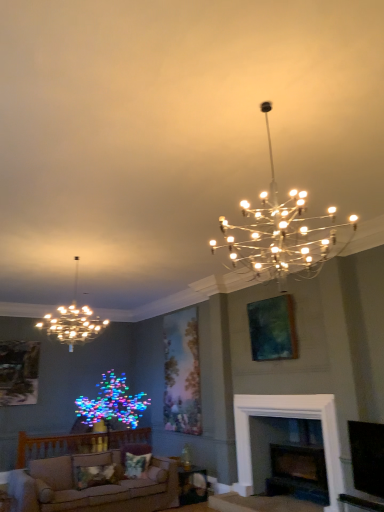
At what (x,y) coordinates should I click in order to perform the action: click on teal matte painting at upper right, marked as the 2th picture frame in a bottom-to-top arrangement. Please return your answer as a coordinate pair (x, y). This screenshot has width=384, height=512. Looking at the image, I should click on (x=273, y=329).

Describe the element at coordinates (273, 329) in the screenshot. I see `teal matte painting at upper right, marked as the 2th picture frame in a bottom-to-top arrangement` at that location.

This screenshot has width=384, height=512. What do you see at coordinates (289, 417) in the screenshot? I see `dark wood fireplace at lower center` at bounding box center [289, 417].

This screenshot has width=384, height=512. I want to click on metallic chandelier at upper center, the first lamp in the right-to-left sequence, so click(x=280, y=231).

Find the location of a particular element. teal matte painting at upper right, arranged as the first picture frame when viewed from the top is located at coordinates (273, 329).

Looking at this image, based on their positions, is teal matte painting at upper right, arranged as the first picture frame when viewed from the top, located to the left or right of beige fabric couch at lower left?

In the image, teal matte painting at upper right, arranged as the first picture frame when viewed from the top, appears on the right side of beige fabric couch at lower left.

In the scene shown: Does teal matte painting at upper right, positioned as the second picture frame in left-to-right order, contain beige fabric couch at lower left?

No, beige fabric couch at lower left is located outside of teal matte painting at upper right, positioned as the second picture frame in left-to-right order.

From a real-world perspective, which object stands above the other?

teal matte painting at upper right, placed as the 1th picture frame when sorted from front to back.

Is wooden textured picture frame at left, which is counted as the 1th picture frame, starting from the left, not near teal matte painting at upper right, marked as the 2th picture frame in a back-to-front arrangement?

Yes.

Can teal matte painting at upper right, positioned as the second picture frame in left-to-right order, be found inside wooden textured picture frame at left, the second picture frame positioned from the right?

That's incorrect, teal matte painting at upper right, positioned as the second picture frame in left-to-right order, is not inside wooden textured picture frame at left, the second picture frame positioned from the right.

Measure the distance between wooden textured picture frame at left, the 1th picture frame from the bottom, and teal matte painting at upper right, marked as the 2th picture frame in a back-to-front arrangement.

wooden textured picture frame at left, the 1th picture frame from the bottom, is 12.51 feet away from teal matte painting at upper right, marked as the 2th picture frame in a back-to-front arrangement.

Locate an element on the screen. This screenshot has width=384, height=512. picture frame above the wooden textured picture frame at left, the 1th picture frame viewed from the back (from a real-world perspective) is located at coordinates (273, 329).

This screenshot has width=384, height=512. What are the coordinates of `picture frame that is the 2nd object located behind the matte gold chandelier at upper left, the 2th lamp in the right-to-left sequence` in the screenshot? It's located at (18, 372).

Relative to wooden textured picture frame at left, the second picture frame positioned from the right, is matte gold chandelier at upper left, the 2th lamp in the front-to-back sequence, in front or behind?

Visually, matte gold chandelier at upper left, the 2th lamp in the front-to-back sequence, is located in front of wooden textured picture frame at left, the second picture frame positioned from the right.

Considering the sizes of objects matte gold chandelier at upper left, the 2th lamp in the right-to-left sequence, and wooden textured picture frame at left, which is counted as the 1th picture frame, starting from the left, in the image provided, who is bigger, matte gold chandelier at upper left, the 2th lamp in the right-to-left sequence, or wooden textured picture frame at left, which is counted as the 1th picture frame, starting from the left,?

With larger size is matte gold chandelier at upper left, the 2th lamp in the right-to-left sequence.

In the scene shown: From a real-world perspective, which is physically above, matte gold chandelier at upper left, the first lamp viewed from the left, or wooden textured picture frame at left, the 2th picture frame from the top?

matte gold chandelier at upper left, the first lamp viewed from the left.

Is dark wood fireplace at lower center positioned with its back to fluffy fabric pillow at lower center?

No, dark wood fireplace at lower center is not facing the opposite direction of fluffy fabric pillow at lower center.

From the image's perspective, is dark wood fireplace at lower center positioned above or below fluffy fabric pillow at lower center?

Based on their image positions, dark wood fireplace at lower center is located above fluffy fabric pillow at lower center.

Can you confirm if dark wood fireplace at lower center is shorter than fluffy fabric pillow at lower center?

No.

From a real-world perspective, is beige fabric couch at lower left positioned under dark wood fireplace at lower center based on gravity?

Yes, from a real-world perspective, beige fabric couch at lower left is beneath dark wood fireplace at lower center.

How many degrees apart are the facing directions of beige fabric couch at lower left and dark wood fireplace at lower center?

The facing directions of beige fabric couch at lower left and dark wood fireplace at lower center are 88.3 degrees apart.

From the image's perspective, which one is positioned higher, beige fabric couch at lower left or dark wood fireplace at lower center?

From the image's view, dark wood fireplace at lower center is above.

Consider the image. Considering the relative sizes of beige fabric couch at lower left and dark wood fireplace at lower center in the image provided, is beige fabric couch at lower left thinner than dark wood fireplace at lower center?

No, beige fabric couch at lower left is not thinner than dark wood fireplace at lower center.

From a real-world perspective, is beige fabric couch at lower left positioned above or below fluffy fabric pillow at lower center?

Clearly, from a real-world perspective, beige fabric couch at lower left is below fluffy fabric pillow at lower center.

Visually, is beige fabric couch at lower left positioned to the left or to the right of fluffy fabric pillow at lower center?

beige fabric couch at lower left is positioned on fluffy fabric pillow at lower center's left side.

Is beige fabric couch at lower left shorter than fluffy fabric pillow at lower center?

No.

Between beige fabric couch at lower left and fluffy fabric pillow at lower center, which one is positioned behind?

Positioned behind is fluffy fabric pillow at lower center.

Considering the sizes of objects wooden textured picture frame at left, which is counted as the 1th picture frame, starting from the left, and metallic chandelier at upper center, marked as the second lamp in a left-to-right arrangement, in the image provided, who is bigger, wooden textured picture frame at left, which is counted as the 1th picture frame, starting from the left, or metallic chandelier at upper center, marked as the second lamp in a left-to-right arrangement,?

metallic chandelier at upper center, marked as the second lamp in a left-to-right arrangement, is bigger.

Is wooden textured picture frame at left, the 1th picture frame from the bottom, located outside metallic chandelier at upper center, marked as the second lamp in a left-to-right arrangement?

Yes.

Is wooden textured picture frame at left, which is counted as the 1th picture frame, starting from the left, taller than metallic chandelier at upper center, marked as the second lamp in a left-to-right arrangement?

Indeed, wooden textured picture frame at left, which is counted as the 1th picture frame, starting from the left, has a greater height compared to metallic chandelier at upper center, marked as the second lamp in a left-to-right arrangement.

Are wooden textured picture frame at left, the second picture frame positioned from the right, and metallic chandelier at upper center, marked as the second lamp in a left-to-right arrangement, far apart?

Yes, wooden textured picture frame at left, the second picture frame positioned from the right, and metallic chandelier at upper center, marked as the second lamp in a left-to-right arrangement, are located far from each other.

The image size is (384, 512). Find the location of `studio couch below the teal matte painting at upper right, acting as the 1th picture frame starting from the right (from the image's perspective)`. studio couch below the teal matte painting at upper right, acting as the 1th picture frame starting from the right (from the image's perspective) is located at coordinates (92, 487).

Where is `picture frame located underneath the teal matte painting at upper right, placed as the 1th picture frame when sorted from front to back (from a real-world perspective)`? This screenshot has width=384, height=512. picture frame located underneath the teal matte painting at upper right, placed as the 1th picture frame when sorted from front to back (from a real-world perspective) is located at coordinates (18, 372).

Considering their positions, is metallic chandelier at upper center, the first lamp in the right-to-left sequence, positioned further to wooden textured picture frame at left, the 1th picture frame viewed from the back, than teal matte painting at upper right, positioned as the second picture frame in left-to-right order?

metallic chandelier at upper center, the first lamp in the right-to-left sequence, is further to wooden textured picture frame at left, the 1th picture frame viewed from the back.

Looking at the image, which one is located further to beige fabric couch at lower left, wooden textured picture frame at left, the 1th picture frame viewed from the back, or metallic chandelier at upper center, which is counted as the 2th lamp, starting from the back?

Among the two, metallic chandelier at upper center, which is counted as the 2th lamp, starting from the back, is located further to beige fabric couch at lower left.

Looking at the image, which one is located further to matte gold chandelier at upper left, the 2th lamp in the right-to-left sequence, metallic chandelier at upper center, which is counted as the 2th lamp, starting from the back, or dark wood fireplace at lower center?

The object further to matte gold chandelier at upper left, the 2th lamp in the right-to-left sequence, is dark wood fireplace at lower center.

When comparing their distances from wooden textured picture frame at left, the 1th picture frame viewed from the back, does matte gold chandelier at upper left, the 2th lamp in the right-to-left sequence, or teal matte painting at upper right, placed as the 1th picture frame when sorted from front to back, seem closer?

The object closer to wooden textured picture frame at left, the 1th picture frame viewed from the back, is matte gold chandelier at upper left, the 2th lamp in the right-to-left sequence.

In the scene shown: Which object lies nearer to the anchor point fluffy fabric pillow at lower center, wooden textured picture frame at left, which is counted as the 1th picture frame, starting from the left, or matte gold chandelier at upper left, the first lamp viewed from the left?

wooden textured picture frame at left, which is counted as the 1th picture frame, starting from the left, lies closer to fluffy fabric pillow at lower center than the other object.

From the image, which object appears to be farther from wooden table at lower center, matte gold chandelier at upper left, the 2th lamp in the front-to-back sequence, or dark wood fireplace at lower center?

matte gold chandelier at upper left, the 2th lamp in the front-to-back sequence, is further to wooden table at lower center.

Looking at the image, which one is located closer to fluffy fabric pillow at lower center, dark wood fireplace at lower center or matte gold chandelier at upper left, the 2th lamp in the front-to-back sequence?

Among the two, dark wood fireplace at lower center is located nearer to fluffy fabric pillow at lower center.

Estimate the real-world distances between objects in this image. Which object is closer to wooden table at lower center, beige fabric couch at lower left or metallic chandelier at upper center, the first lamp positioned from the front?

beige fabric couch at lower left is positioned closer to the anchor wooden table at lower center.

Locate an element on the screen. studio couch between metallic chandelier at upper center, marked as the second lamp in a left-to-right arrangement, and fluffy fabric pillow at lower center from front to back is located at coordinates (92, 487).

Locate an element on the screen. studio couch between teal matte painting at upper right, acting as the 1th picture frame starting from the right, and wooden table at lower center vertically is located at coordinates (92, 487).

I want to click on picture frame between metallic chandelier at upper center, which is counted as the 2th lamp, starting from the back, and wooden textured picture frame at left, the 1th picture frame viewed from the back, from front to back, so click(x=273, y=329).

You are a GUI agent. You are given a task and a screenshot of the screen. Output one action in this format:
    pyautogui.click(x=<x>, y=<y>)
    Task: Click on the picture frame between beige fabric couch at lower left and dark wood fireplace at lower center from left to right
    Image resolution: width=384 pixels, height=512 pixels.
    Given the screenshot: What is the action you would take?
    pyautogui.click(x=273, y=329)